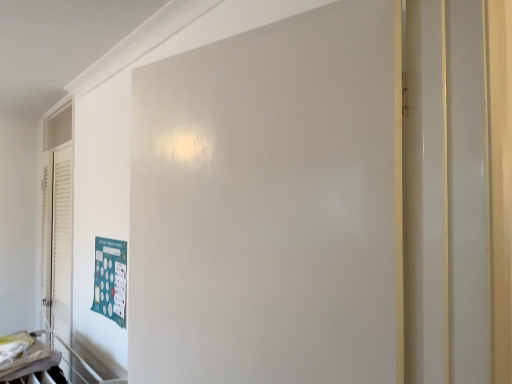
Question: Considering the relative sizes of white matte door at center and teal matte poster at lower left in the image provided, is white matte door at center taller than teal matte poster at lower left?

Choices:
 (A) no
 (B) yes

Answer: (B)

Question: Is white matte door at center at the right side of teal matte poster at lower left?

Choices:
 (A) yes
 (B) no

Answer: (A)

Question: Could teal matte poster at lower left be considered to be inside white matte door at center?

Choices:
 (A) no
 (B) yes

Answer: (A)

Question: Does white matte door at center appear on the left side of teal matte poster at lower left?

Choices:
 (A) yes
 (B) no

Answer: (B)

Question: From the image's perspective, would you say white matte door at center is shown under teal matte poster at lower left?

Choices:
 (A) yes
 (B) no

Answer: (B)

Question: Is white matte door at center smaller than teal matte poster at lower left?

Choices:
 (A) yes
 (B) no

Answer: (B)

Question: From the image's perspective, is teal matte poster at lower left under white matte door at center?

Choices:
 (A) no
 (B) yes

Answer: (B)

Question: Is teal matte poster at lower left closer to camera compared to white matte door at center?

Choices:
 (A) yes
 (B) no

Answer: (B)

Question: Is teal matte poster at lower left aimed at white matte door at center?

Choices:
 (A) yes
 (B) no

Answer: (B)

Question: Considering the relative sizes of teal matte poster at lower left and white matte door at center in the image provided, is teal matte poster at lower left taller than white matte door at center?

Choices:
 (A) no
 (B) yes

Answer: (A)

Question: From a real-world perspective, is teal matte poster at lower left positioned over white matte door at center based on gravity?

Choices:
 (A) no
 (B) yes

Answer: (A)

Question: Does teal matte poster at lower left have a greater width compared to white matte door at center?

Choices:
 (A) yes
 (B) no

Answer: (B)

Question: In the image, is white matte door at center positioned in front of or behind teal matte poster at lower left?

Choices:
 (A) front
 (B) behind

Answer: (A)